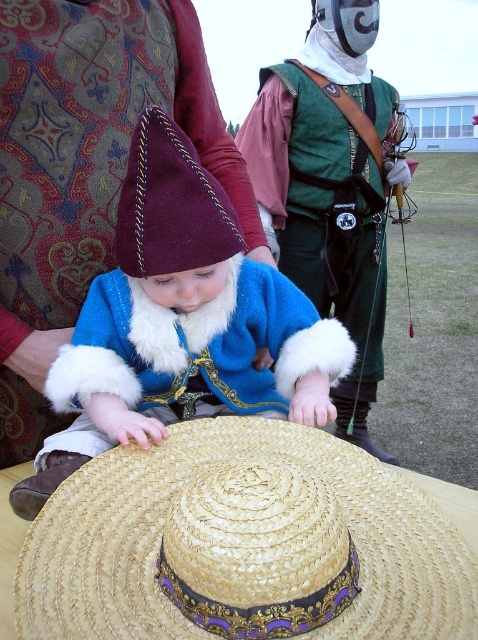
Who is lower down, maroon felt hat at center or green leather armor at center?

maroon felt hat at center is below.

Can you confirm if maroon felt hat at center is positioned to the left of green leather armor at center?

Correct, you'll find maroon felt hat at center to the left of green leather armor at center.

Locate an element on the screen. The height and width of the screenshot is (640, 478). maroon felt hat at center is located at coordinates (189, 312).

I want to click on maroon felt hat at center, so click(189, 312).

Is point (406, 625) closer to viewer compared to point (126, 346)?

Yes, it is.

Does woven straw sombrero at center have a lesser height compared to maroon felt hat at center?

Correct, woven straw sombrero at center is not as tall as maroon felt hat at center.

Who is more forward, (282,451) or (152,291)?

Positioned in front is point (282,451).

Locate an element on the screen. This screenshot has width=478, height=640. woven straw sombrero at center is located at coordinates (242, 545).

Does woven straw sombrero at center have a larger size compared to green leather armor at center?

Actually, woven straw sombrero at center might be smaller than green leather armor at center.

Measure the distance between point (x=261, y=618) and camera.

They are 30.77 inches apart.

I want to click on woven straw sombrero at center, so click(x=242, y=545).